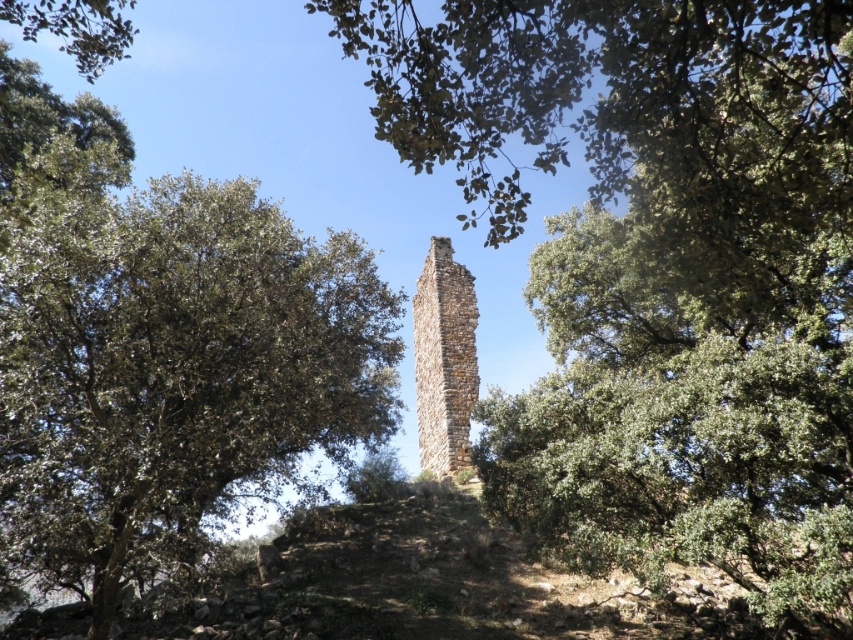
Who is positioned more to the left, green leafy tree at left or brown stone chimney at center?

Positioned to the left is green leafy tree at left.

Based on the photo, which of these two, green leafy tree at left or brown stone chimney at center, stands shorter?

brown stone chimney at center

Is point (183, 477) more distant than point (461, 445)?

No, it is in front of (461, 445).

The height and width of the screenshot is (640, 853). Find the location of `green leafy tree at left`. green leafy tree at left is located at coordinates (160, 349).